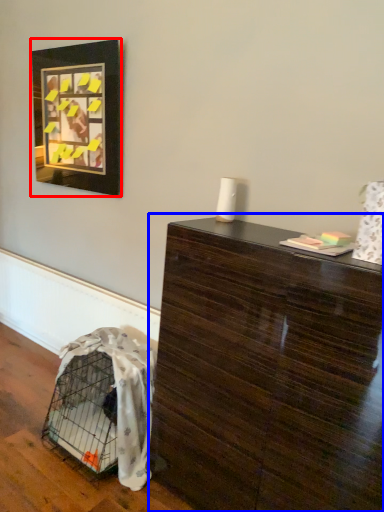
Question: Which of the following is the closest to the observer, picture frame (highlighted by a red box) or table (highlighted by a blue box)?

Choices:
 (A) picture frame
 (B) table

Answer: (B)